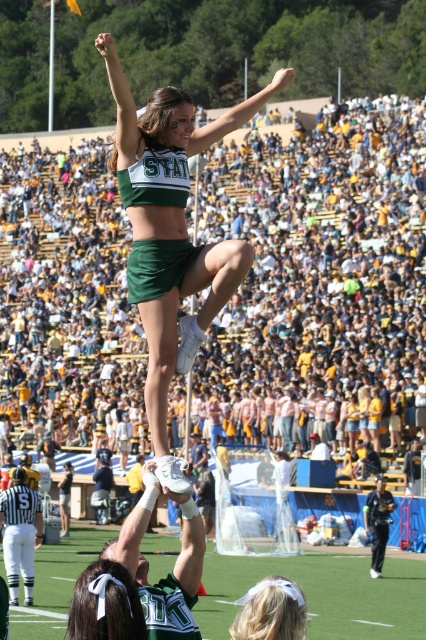
Based on the photo, you are a photographer standing at the edge of the field. You want to capture a photo that includes both the yellow and white crowd at upper center and the white satin headband at lower center. Which object should you focus on first to ensure both are in frame?

You should focus on the yellow and white crowd at upper center first because it might be wider than the white satin headband at lower center, so adjusting the camera angle to accommodate its width will help include both in the frame.

You are a photographer at the event and want to capture a photo of the green matte uniform at center and the green turf football field at center. Based on their positions, which object is closer to the left side of the image?

The green matte uniform at center is to the left of the green turf football field at center, so the green matte uniform at center is closer to the left side of the image.